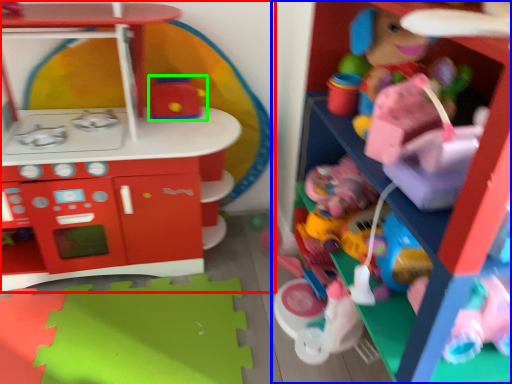
Question: Which is farther away from toy (highlighted by a red box)? toy (highlighted by a blue box) or toy (highlighted by a green box)?

Choices:
 (A) toy
 (B) toy

Answer: (A)